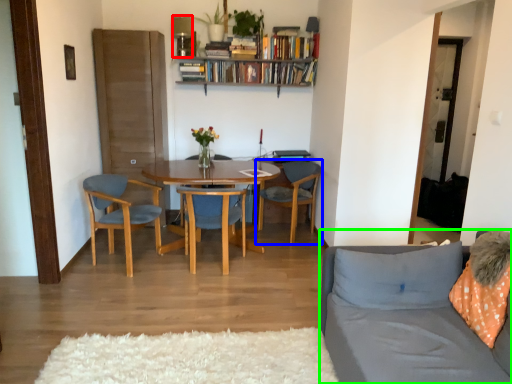
Question: Estimate the real-world distances between objects in this image. Which object is closer to lamp (highlighted by a red box), chair (highlighted by a blue box) or studio couch (highlighted by a green box)?

Choices:
 (A) chair
 (B) studio couch

Answer: (A)